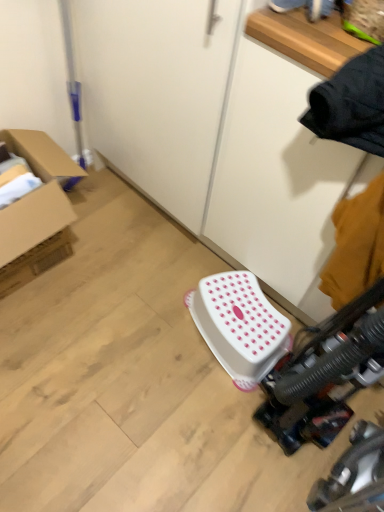
I want to click on free spot to the right of cardboard box at left, so click(x=139, y=267).